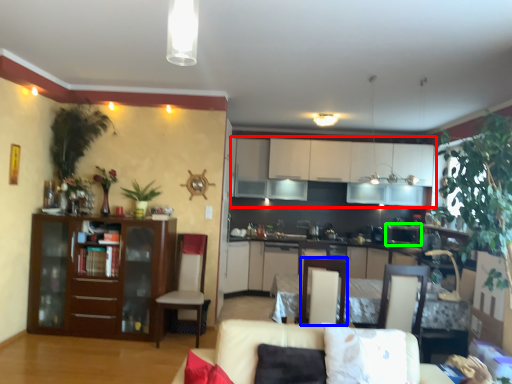
Question: Which object is the closest to the cabinetry (highlighted by a red box)? Choose among these: armchair (highlighted by a blue box) or appliance (highlighted by a green box).

Choices:
 (A) armchair
 (B) appliance

Answer: (B)